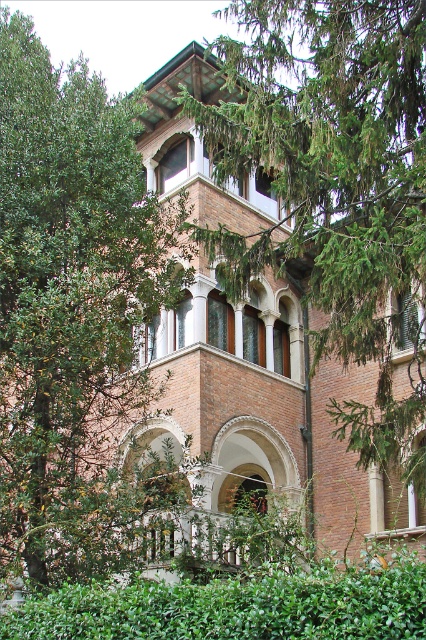
You are standing in front of the building and notice a point marked at coordinates (x=71, y=307). Based on the scene description, what object is located at that point?

The point at coordinates (x=71, y=307) indicates the location of the green leafy tree at left.

You are standing in front of the building and want to know which of the two plants is higher. Which one is taller between the green leafy tree at left and the green leafy hedge at lower center?

The green leafy tree at left is taller than the green leafy hedge at lower center.